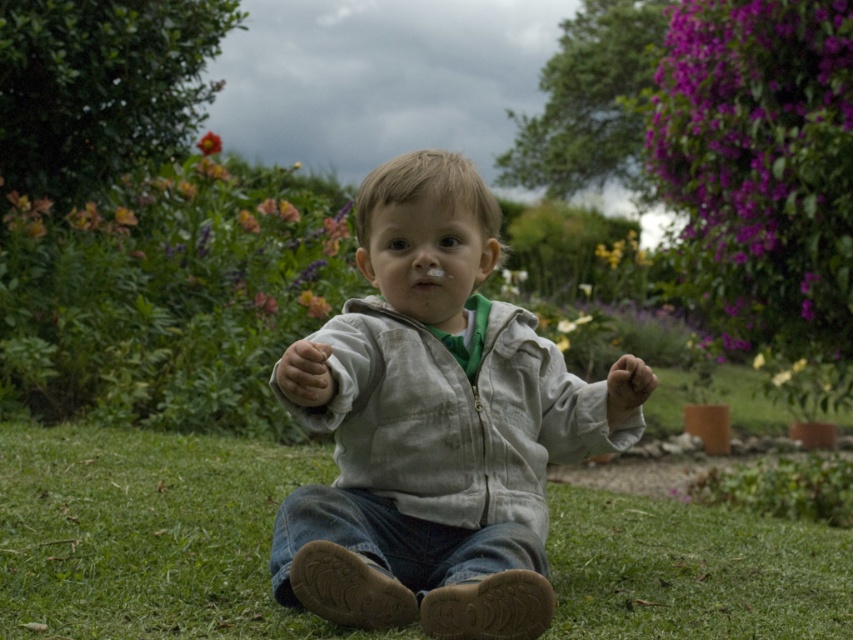
Question: Which point is farther to the camera?

Choices:
 (A) (460, 388)
 (B) (206, 148)
 (C) (761, 202)
 (D) (138, 576)

Answer: (B)

Question: Can you confirm if purple matte flowers at upper right is smaller than smooth yellow flower at upper left?

Choices:
 (A) yes
 (B) no

Answer: (B)

Question: Does green grass at center have a smaller size compared to purple matte flowers at upper right?

Choices:
 (A) yes
 (B) no

Answer: (A)

Question: Does light gray cotton jacket at center have a larger size compared to green grass at center?

Choices:
 (A) yes
 (B) no

Answer: (B)

Question: Considering the real-world distances, which object is closest to the green grass at center?

Choices:
 (A) purple matte flowers at upper right
 (B) smooth yellow flower at upper left
 (C) light gray cotton jacket at center

Answer: (C)

Question: Among these objects, which one is nearest to the camera?

Choices:
 (A) green grass at center
 (B) purple matte flowers at upper right
 (C) smooth yellow flower at upper left
 (D) light gray cotton jacket at center

Answer: (D)